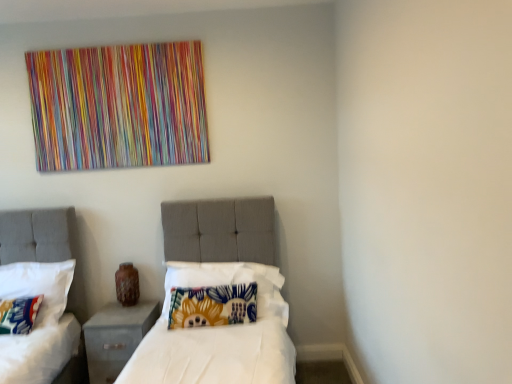
Question: From the image's perspective, is fluffy multicolored pillow at lower left, arranged as the first pillow when viewed from the left, below floral fabric pillow at center, which appears as the first pillow when viewed from the right?

Choices:
 (A) no
 (B) yes

Answer: (B)

Question: Would you say fluffy multicolored pillow at lower left, arranged as the first pillow when viewed from the left, is outside floral fabric pillow at center, which appears as the first pillow when viewed from the right?

Choices:
 (A) yes
 (B) no

Answer: (A)

Question: Is fluffy multicolored pillow at lower left, placed as the third pillow when sorted from right to left, facing towards floral fabric pillow at center, which appears as the first pillow when viewed from the right?

Choices:
 (A) yes
 (B) no

Answer: (B)

Question: Is fluffy multicolored pillow at lower left, arranged as the first pillow when viewed from the left, shorter than floral fabric pillow at center, the third pillow positioned from the left?

Choices:
 (A) no
 (B) yes

Answer: (B)

Question: From a real-world perspective, is fluffy multicolored pillow at lower left, placed as the third pillow when sorted from right to left, on floral fabric pillow at center, the third pillow positioned from the left?

Choices:
 (A) no
 (B) yes

Answer: (A)

Question: Looking at their shapes, would you say gray fabric nightstand at lower left is wider or thinner than floral fabric pillow at left, the second pillow positioned from the right?

Choices:
 (A) wide
 (B) thin

Answer: (A)

Question: Considering the positions of point (117, 322) and point (31, 274), is point (117, 322) closer or farther from the camera than point (31, 274)?

Choices:
 (A) closer
 (B) farther

Answer: (A)

Question: Considering the positions of gray fabric nightstand at lower left and floral fabric pillow at left, positioned as the second pillow in left-to-right order, in the image, is gray fabric nightstand at lower left taller or shorter than floral fabric pillow at left, positioned as the second pillow in left-to-right order,?

Choices:
 (A) short
 (B) tall

Answer: (A)

Question: Would you say gray fabric nightstand at lower left is to the left or to the right of floral fabric pillow at left, the second pillow positioned from the right, in the picture?

Choices:
 (A) right
 (B) left

Answer: (A)

Question: Is floral fabric pillow at center, which appears as the first pillow when viewed from the right, in front of or behind floral fabric pillow at left, the second pillow positioned from the right, in the image?

Choices:
 (A) front
 (B) behind

Answer: (A)

Question: In terms of width, does floral fabric pillow at center, the third pillow positioned from the left, look wider or thinner when compared to floral fabric pillow at left, the second pillow positioned from the right?

Choices:
 (A) thin
 (B) wide

Answer: (A)

Question: Is point (222, 288) positioned closer to the camera than point (33, 292)?

Choices:
 (A) farther
 (B) closer

Answer: (B)

Question: Based on their sizes in the image, would you say floral fabric pillow at center, the third pillow positioned from the left, is bigger or smaller than floral fabric pillow at left, the second pillow positioned from the right?

Choices:
 (A) small
 (B) big

Answer: (A)

Question: Is fluffy multicolored pillow at lower left, arranged as the first pillow when viewed from the left, wider or thinner than floral fabric pillow at left, the second pillow positioned from the right?

Choices:
 (A) wide
 (B) thin

Answer: (B)

Question: Is fluffy multicolored pillow at lower left, placed as the third pillow when sorted from right to left, taller or shorter than floral fabric pillow at left, the second pillow positioned from the right?

Choices:
 (A) short
 (B) tall

Answer: (A)